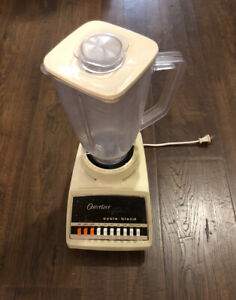
The height and width of the screenshot is (300, 236). I want to click on light reflection off table, so click(209, 212).